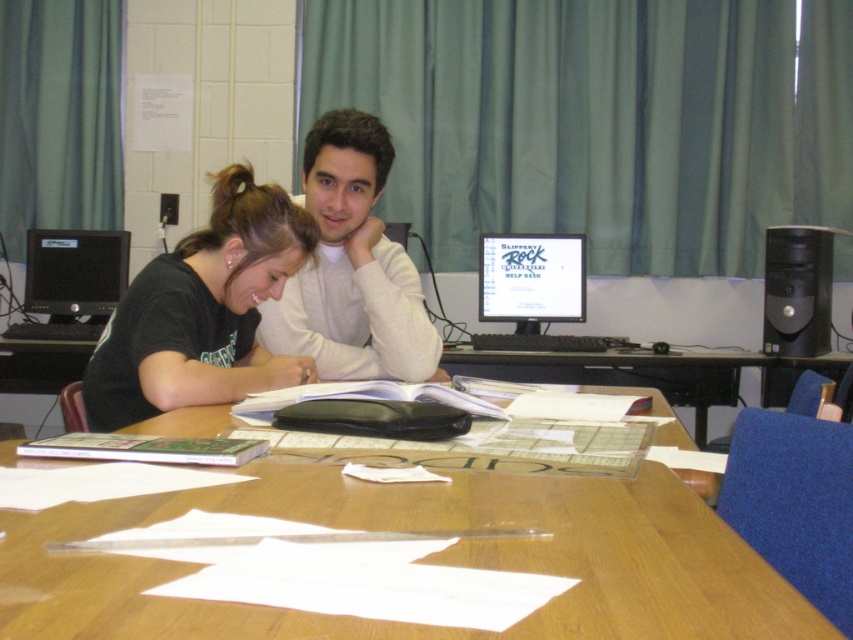
You are trying to decide where to place a new laptop stand that requires 20 cm of vertical space. Based on the scene, can the wooden table at center support the stand if it needs to be placed next to the matte black monitor at left?

The wooden table at center is not as tall as the matte black monitor at left, so the monitor is taller than the table. Since the laptop stand requires 20 cm of vertical space, it might not fit properly on the table if the monitor is already occupying that height. However, without knowing the exact height of the table, it is difficult to determine definitively.

You are standing in front of the table in the image. There are two points marked on the table surface. The first point is at coordinates point (363, 257) and the second point is at point (572, 250). Which of these two points is closer to you?

Point (363, 257) is closer to the viewer than point (572, 250).

You are a photographer setting up a shoot in this room. You need to position a small lamp so that it illuminates the white matte sweater at center without casting a shadow on the matte black monitor at center. Is this possible based on their current positions?

The white matte sweater at center is above the matte black monitor at center, so placing the lamp in a position where its light can reach the sweater from above while avoiding the monitor below would work. Yes, it is possible to illuminate the white matte sweater at center without casting a shadow on the matte black monitor at center by positioning the lamp appropriately above or to the side.